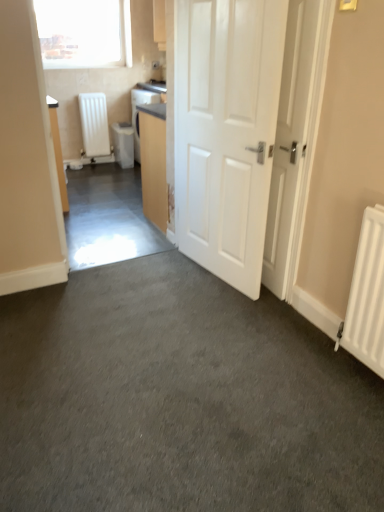
Where is `vacant position to the left of matte wood cabinet at center`? vacant position to the left of matte wood cabinet at center is located at coordinates (120, 221).